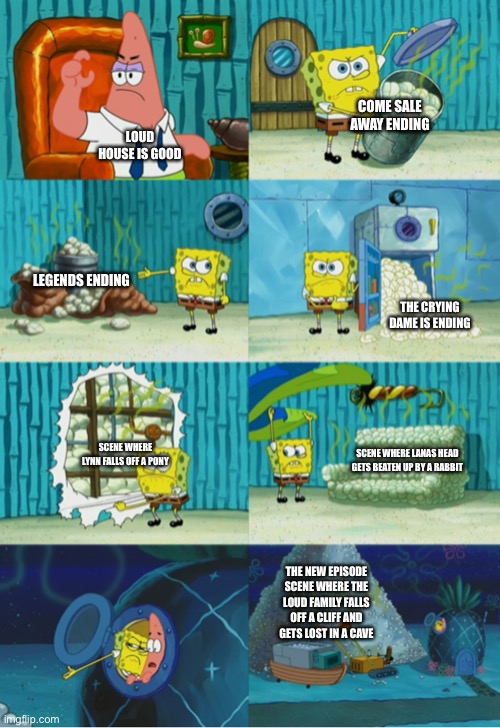
Find the location of a particular element. This screenshot has height=728, width=500. window is located at coordinates (88, 630).